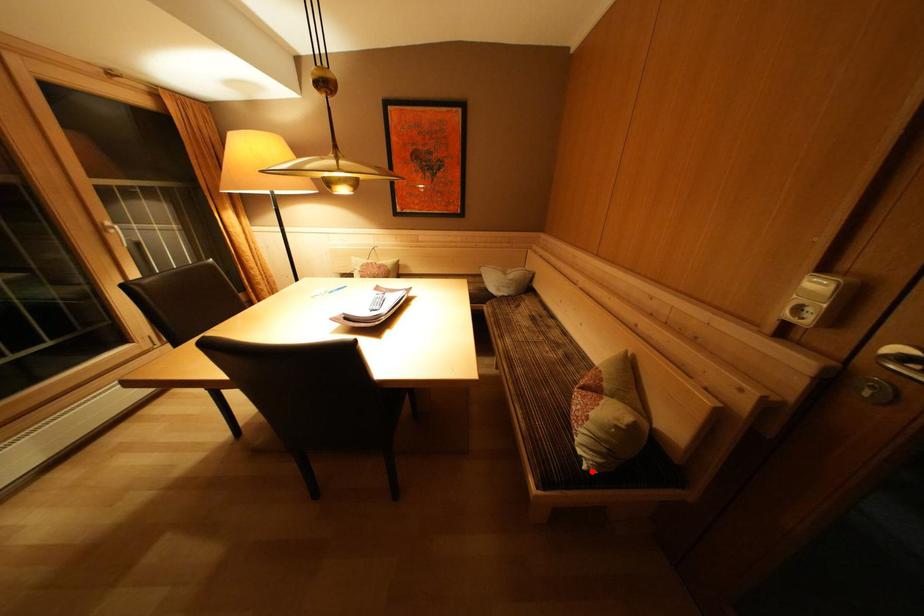
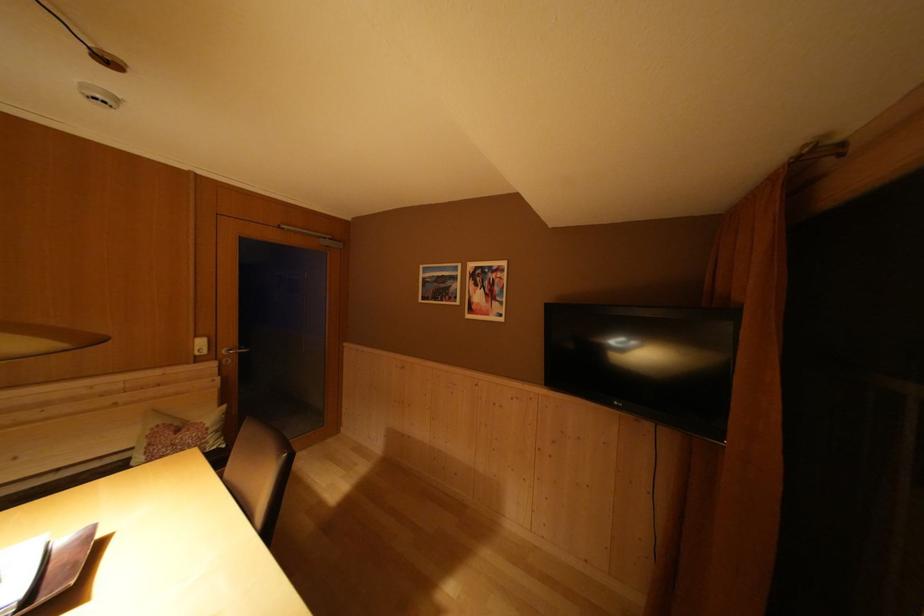
Locate, in the second image, the point that corresponds to the highlighted location in the first image.

(231, 451)